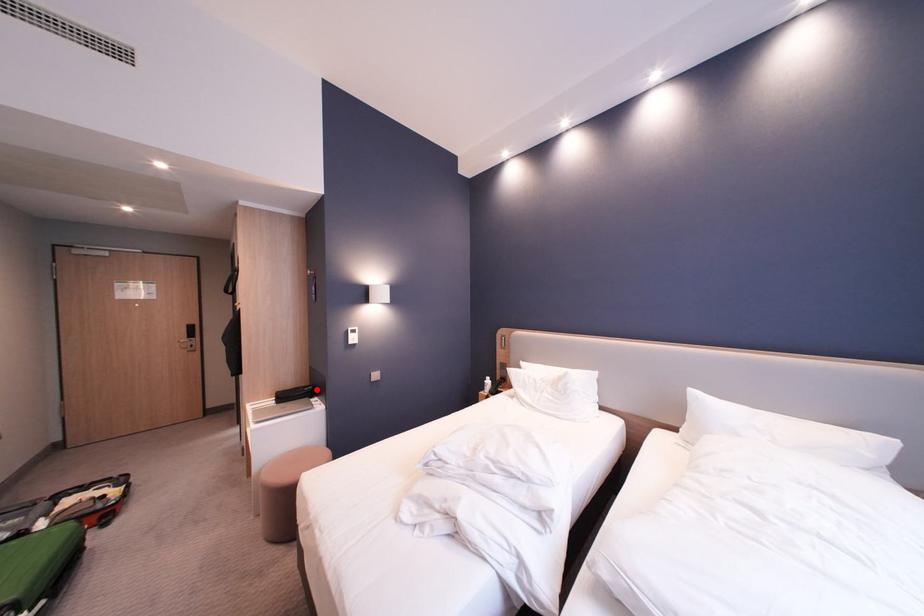
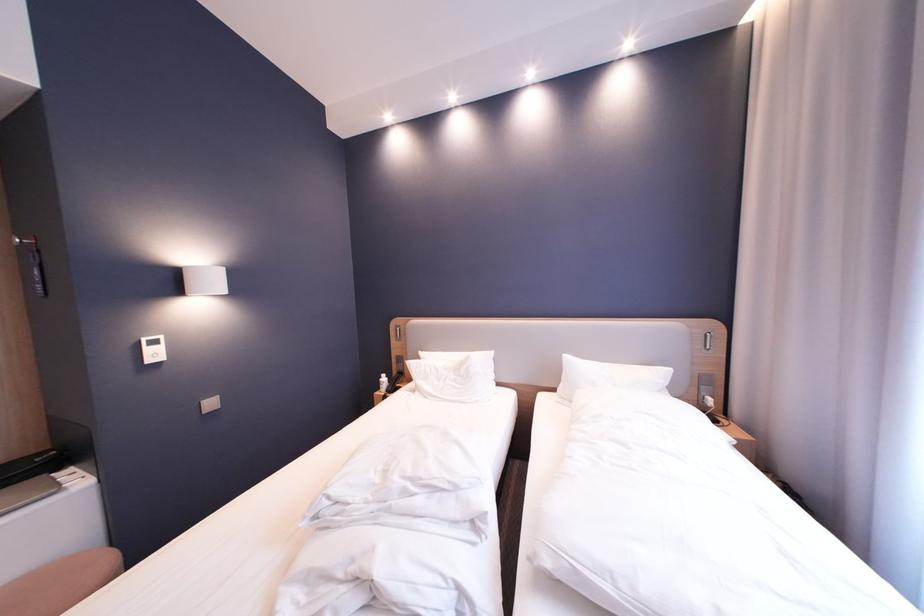
Locate, in the second image, the point that corresponds to the highlighted location in the first image.

(51, 460)